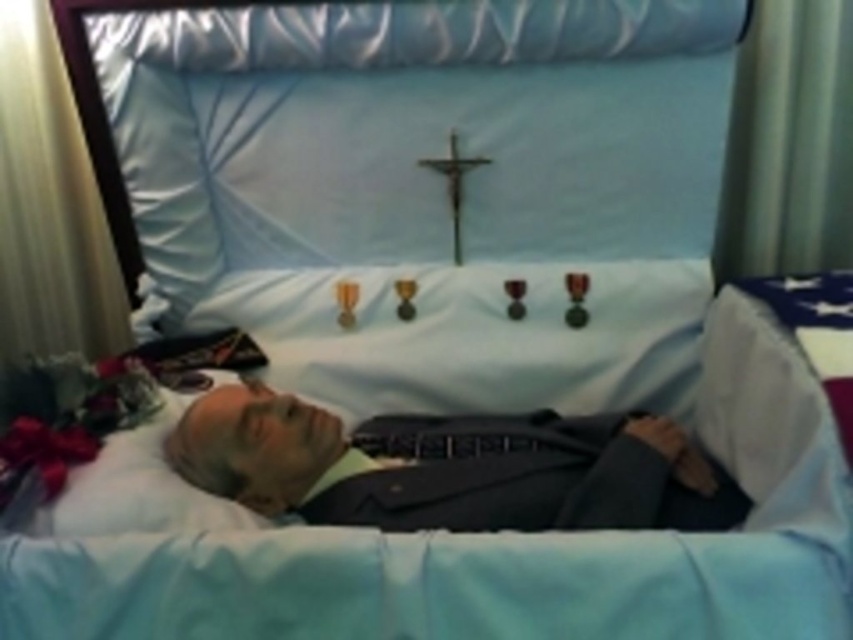
Consider the image. You are an event organizer planning a memorial service. You need to ensure that the dark gray suit at center and the metallic crucifix at center are both visible to attendees seated in the front row. Given their sizes, which object might require closer attention to ensure visibility?

The dark gray suit at center is larger in size than the metallic crucifix at center, so the crucifix may need closer attention to ensure its visibility since it is smaller.

You are a photographer tasked with capturing a closeup of the dark gray suit at center and the metallic crucifix at center. Which object should you focus on first if you want to ensure both are in frame without moving the camera?

The dark gray suit at center is wider than the metallic crucifix at center, so you should focus on the dark gray suit at center first to ensure it fits within the frame before adjusting for the smaller crucifix.

You are a funeral director standing 1.60 meters away from the casket. You need to adjust the position of the dark gray suit at center so that it is closer to the viewer. How much closer can you move it?

The dark gray suit at center is currently 1.40 meters away from the viewer. To move it closer, you can bring it to within 0.20 meters, as the minimum safe distance would be the difference between your current position and the desired adjustment.